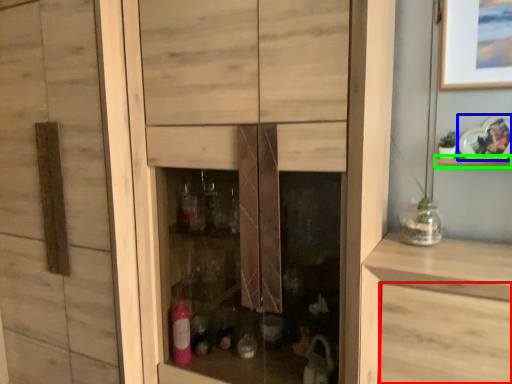
Question: Based on their relative distances, which object is farther from drawer (highlighted by a red box)? Choose from picture frame (highlighted by a blue box) and shelf (highlighted by a green box).

Choices:
 (A) picture frame
 (B) shelf

Answer: (A)